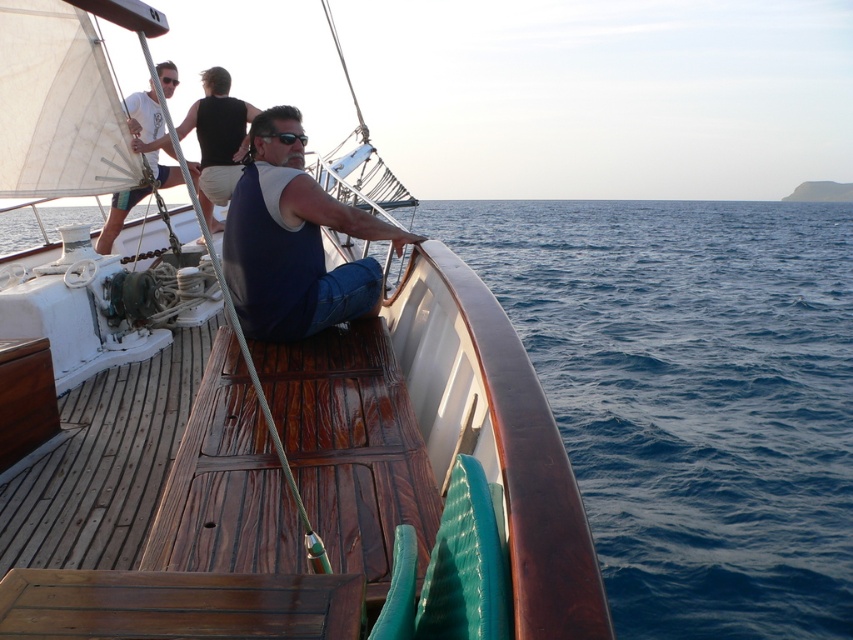
Question: Does wooden deck at center have a lesser width compared to blue denim jeans at center?

Choices:
 (A) yes
 (B) no

Answer: (B)

Question: Which point is closer to the camera?

Choices:
 (A) dark blue sleeveless shirt at upper center
 (B) white fabric sail at upper left

Answer: (A)

Question: Is dark blue sleeveless shirt at upper center to the left of black plastic goggles at upper center from the viewer's perspective?

Choices:
 (A) no
 (B) yes

Answer: (A)

Question: Can you confirm if black plastic goggles at center is positioned to the left of black plastic goggles at upper center?

Choices:
 (A) yes
 (B) no

Answer: (B)

Question: Which point appears closest to the camera in this image?

Choices:
 (A) (282, 138)
 (B) (225, 140)
 (C) (115, 179)

Answer: (A)

Question: Which object appears farthest from the camera in this image?

Choices:
 (A) blue denim jeans at center
 (B) black plastic goggles at center
 (C) white fabric sail at upper left
 (D) dark blue sleeveless shirt at upper center

Answer: (C)